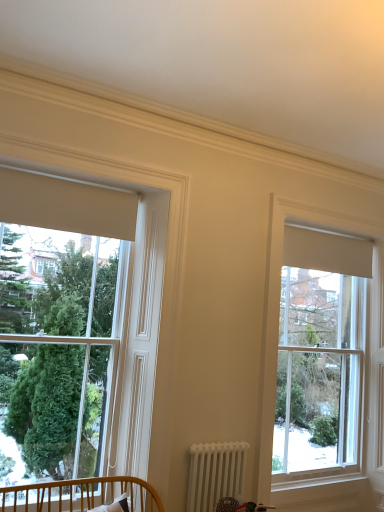
Question: Does point (288, 378) appear closer or farther from the camera than point (203, 452)?

Choices:
 (A) closer
 (B) farther

Answer: (B)

Question: Looking at their shapes, would you say clear glass window at upper right, the second window in the left-to-right sequence, is wider or thinner than white metallic radiator at lower center?

Choices:
 (A) wide
 (B) thin

Answer: (A)

Question: Which is nearer to the clear glass window at upper right, the second window in the left-to-right sequence?

Choices:
 (A) white metallic radiator at lower center
 (B) wooden crib at lower left
 (C) matte white window at left, positioned as the 2th window in right-to-left order

Answer: (A)

Question: Which of these objects is positioned closest to the clear glass window at upper right, which ranks as the first window in right-to-left order?

Choices:
 (A) wooden crib at lower left
 (B) matte white window at left, acting as the 1th window starting from the front
 (C) white metallic radiator at lower center

Answer: (C)